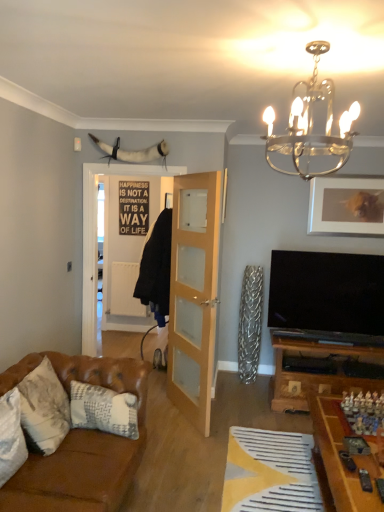
At what (x,y) coordinates should I click in order to perform the action: click on free space above matte silver picture frame at upper right (from a real-world perspective). Please return your answer as a coordinate pair (x, y). Looking at the image, I should click on (345, 174).